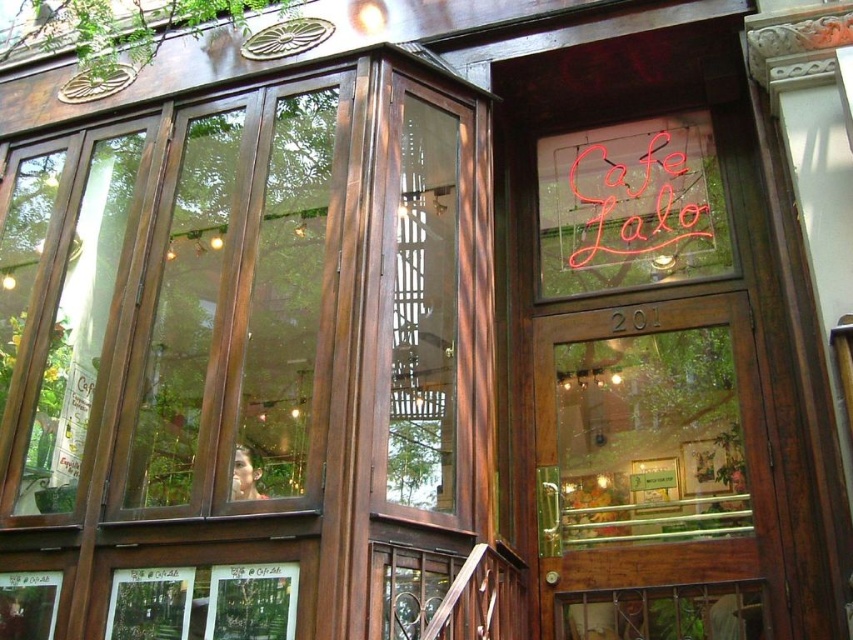
In the scene shown: Which is above, wooden door at center or wooden sign at center?

wooden sign at center

Is wooden door at center to the left of wooden sign at center from the viewer's perspective?

Correct, you'll find wooden door at center to the left of wooden sign at center.

Does point (675, 580) lie in front of point (637, 317)?

Yes, it is.

Locate an element on the screen. This screenshot has width=853, height=640. wooden door at center is located at coordinates (654, 477).

Between neon sign at upper right and wooden sign at center, which one appears on the left side from the viewer's perspective?

wooden sign at center is more to the left.

Which of these two, neon sign at upper right or wooden sign at center, stands shorter?

Standing shorter between the two is wooden sign at center.

Is point (608, 156) farther from viewer compared to point (645, 321)?

Yes, point (608, 156) is farther from viewer.

This screenshot has height=640, width=853. Find the location of `neon sign at upper right`. neon sign at upper right is located at coordinates (637, 200).

Is wooden door at center further to the viewer compared to neon sign at upper right?

No.

Is point (761, 579) closer to viewer compared to point (705, 234)?

Yes.

This screenshot has width=853, height=640. Describe the element at coordinates (654, 477) in the screenshot. I see `wooden door at center` at that location.

Identify the location of wooden door at center. This screenshot has height=640, width=853. (654, 477).